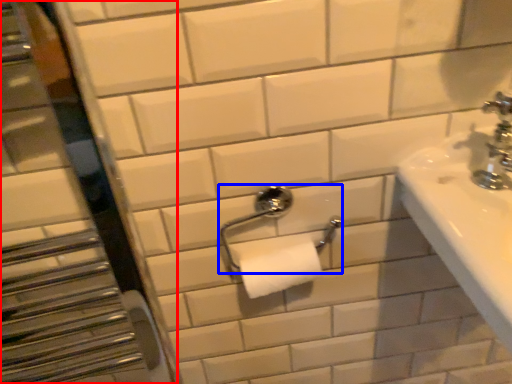
Question: Which of the following is the closest to the observer, mirror (highlighted by a red box) or towel bar (highlighted by a blue box)?

Choices:
 (A) mirror
 (B) towel bar

Answer: (A)